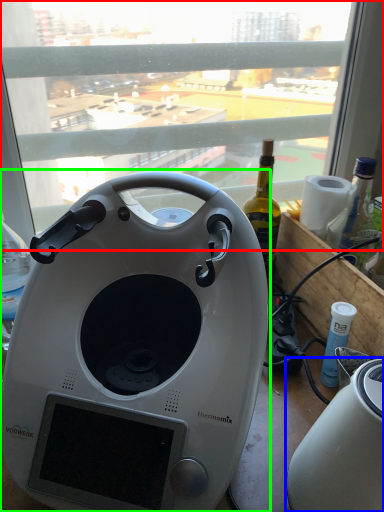
Question: Which is nearer to the window (highlighted by a red box)? toaster (highlighted by a blue box) or home appliance (highlighted by a green box).

Choices:
 (A) toaster
 (B) home appliance

Answer: (B)